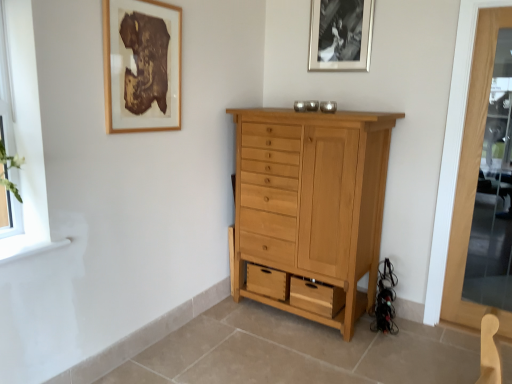
Question: Is black matte picture frame at upper center, which is the 1th picture frame in back-to-front order, spatially inside transparent glass screen door at right, or outside of it?

Choices:
 (A) inside
 (B) outside

Answer: (B)

Question: Considering the positions of point (310, 4) and point (440, 311), is point (310, 4) closer or farther from the camera than point (440, 311)?

Choices:
 (A) farther
 (B) closer

Answer: (A)

Question: Which object is the closest to the black matte picture frame at upper center, which is counted as the second picture frame, starting from the left?

Choices:
 (A) natural wood cabinet at center
 (B) transparent glass screen door at right
 (C) clear glass window at left
 (D) wooden picture frame at upper left, which appears as the 2th picture frame when viewed from the back

Answer: (B)

Question: Which object is the farthest from the clear glass window at left?

Choices:
 (A) transparent glass screen door at right
 (B) black matte picture frame at upper center, which is counted as the 1th picture frame, starting from the right
 (C) natural wood cabinet at center
 (D) wooden picture frame at upper left, placed as the 2th picture frame when sorted from right to left

Answer: (A)